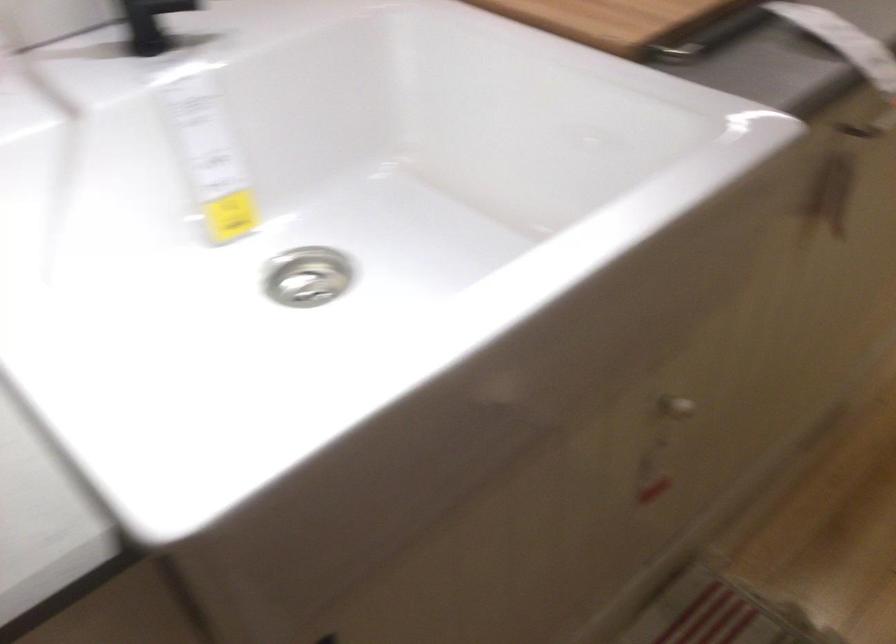
Find where to push the black faucet handle. Please return your answer as a coordinate pair (x, y).

(151, 23)